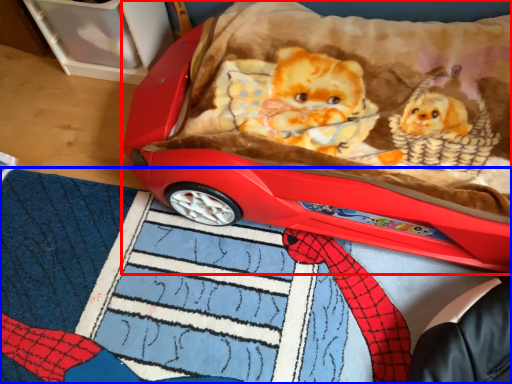
Question: Among these objects, which one is farthest to the camera, toy (highlighted by a red box) or mat (highlighted by a blue box)?

Choices:
 (A) toy
 (B) mat

Answer: (A)